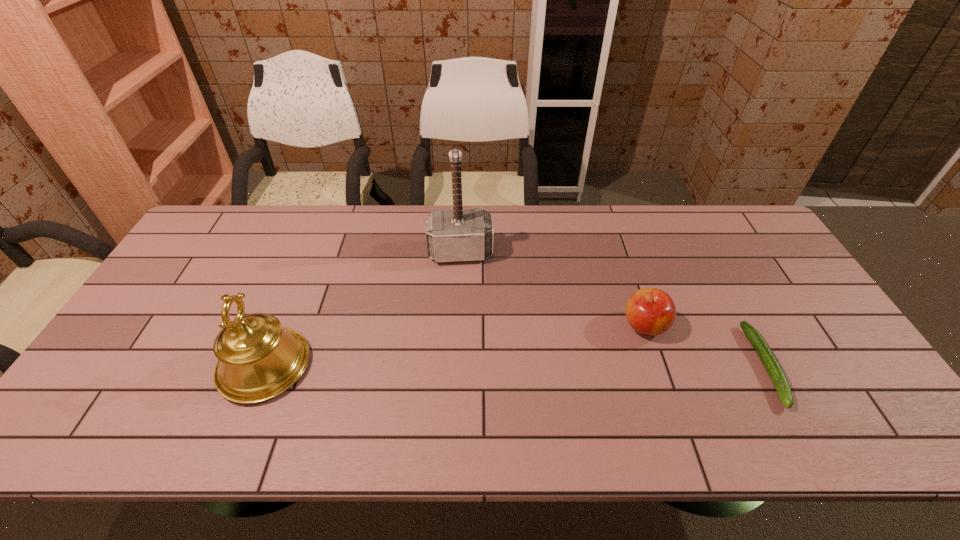
At what (x,y) coordinates should I click in order to perform the action: click on free space on the desktop that is between the third shortest object and the zucchini and is positioned on the stem of the apple. Please return your answer as a coordinate pair (x, y). This screenshot has width=960, height=540. Looking at the image, I should click on (587, 366).

You are a GUI agent. You are given a task and a screenshot of the screen. Output one action in this format:
    pyautogui.click(x=<x>, y=<y>)
    Task: Click on the free space on the desktop that is between the leftmost object and the zucchini and is positioned for striking with the head of the farthest object
    The image size is (960, 540).
    Given the screenshot: What is the action you would take?
    pyautogui.click(x=467, y=366)